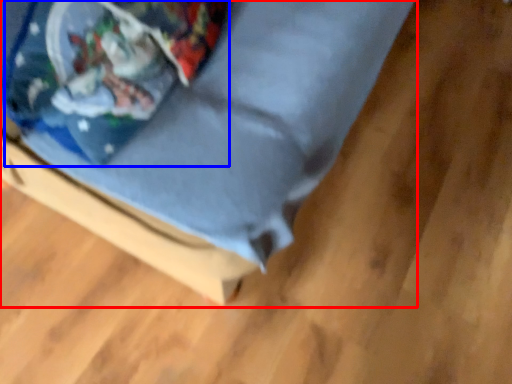
Question: Which object is closer to the camera taking this photo, furniture (highlighted by a red box) or wrapping paper (highlighted by a blue box)?

Choices:
 (A) furniture
 (B) wrapping paper

Answer: (A)